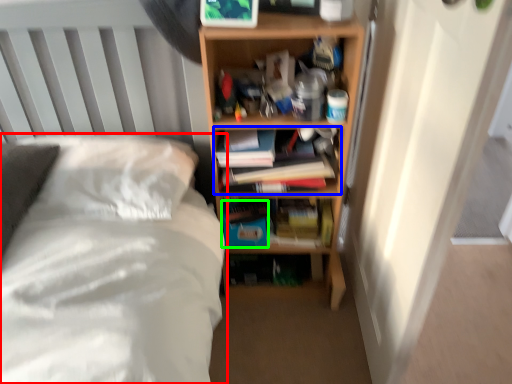
Question: Which is farther away from bed (highlighted by a red box)? book (highlighted by a blue box) or paperback book (highlighted by a green box)?

Choices:
 (A) book
 (B) paperback book

Answer: (B)